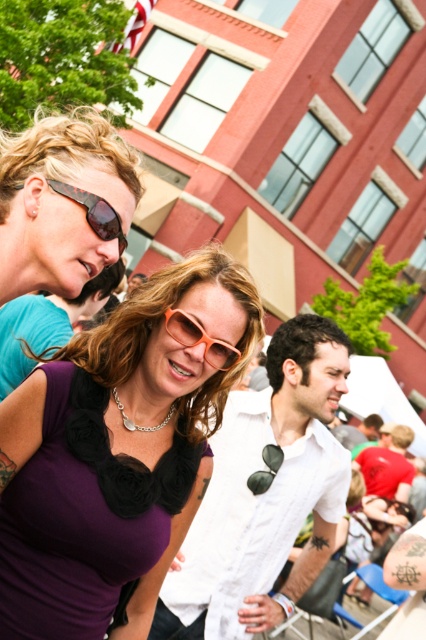
Question: Can you confirm if purple fabric top at center is positioned below orange matte sunglasses at center?

Choices:
 (A) yes
 (B) no

Answer: (A)

Question: Which point is closer to the camera?

Choices:
 (A) (69, 230)
 (B) (187, 433)

Answer: (A)

Question: Considering the relative positions of matte black sunglasses at upper left and matte white shirt at center in the image provided, where is matte black sunglasses at upper left located with respect to matte white shirt at center?

Choices:
 (A) above
 (B) below

Answer: (A)

Question: Is purple fabric top at center smaller than white matte shirt at center?

Choices:
 (A) yes
 (B) no

Answer: (A)

Question: Which point is closer to the camera taking this photo?

Choices:
 (A) (310, 403)
 (B) (71, 230)
 (C) (206, 305)

Answer: (B)

Question: Based on their relative distances, which object is nearer to the matte black sunglasses at upper left?

Choices:
 (A) brown textured sunglasses at upper left
 (B) matte white shirt at center
 (C) purple fabric top at center

Answer: (A)